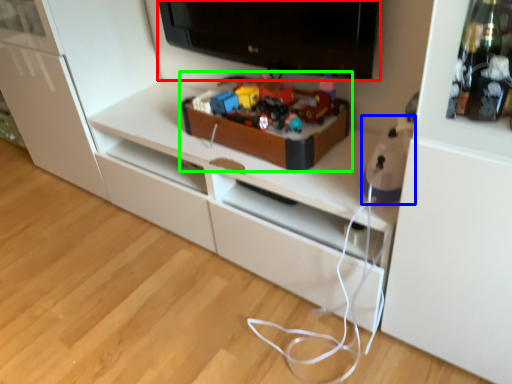
Question: Which is farther away from television (highlighted by a red box)? toy (highlighted by a blue box) or toy (highlighted by a green box)?

Choices:
 (A) toy
 (B) toy

Answer: (A)